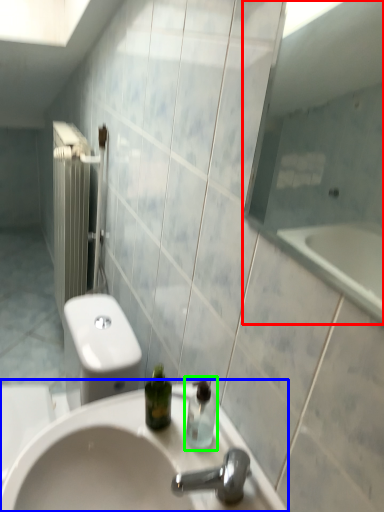
Question: Based on their relative distances, which object is farther from mirror (highlighted by a red box)? Choose from sink (highlighted by a blue box) and soap dispenser (highlighted by a green box).

Choices:
 (A) sink
 (B) soap dispenser

Answer: (B)